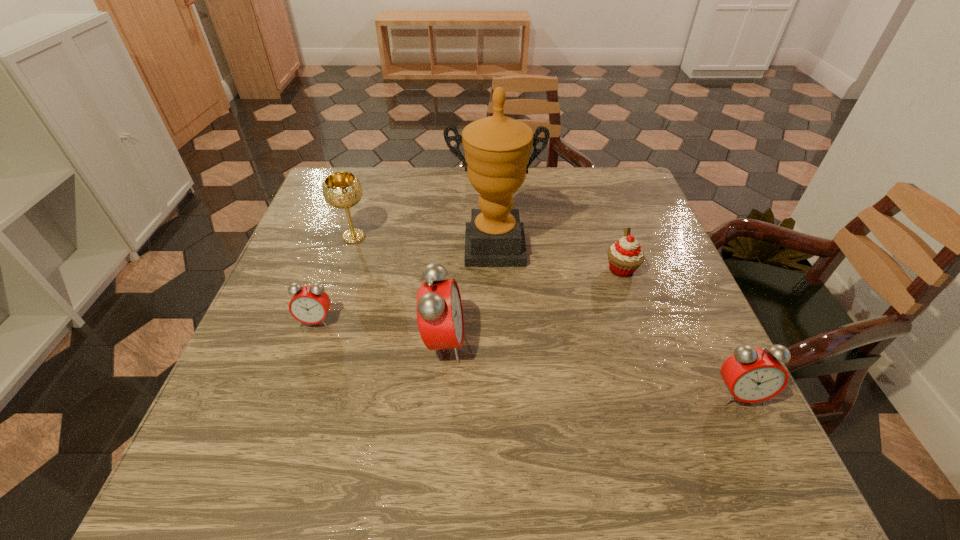
This screenshot has width=960, height=540. Identify the location of free space at the left edge. (332, 239).

The width and height of the screenshot is (960, 540). In the image, there is a desktop. Find the location of `blank space at the right edge`. blank space at the right edge is located at coordinates (682, 379).

The image size is (960, 540). I want to click on free spot at the far left corner of the desktop, so click(x=351, y=168).

Image resolution: width=960 pixels, height=540 pixels. What are the coordinates of `free spot at the far right corner of the desktop` in the screenshot? It's located at (603, 194).

The width and height of the screenshot is (960, 540). Find the location of `free space between the second alarm clock from right to left and the shortest alarm clock`. free space between the second alarm clock from right to left and the shortest alarm clock is located at coordinates (380, 332).

Find the location of a particular element. The image size is (960, 540). vacant area that lies between the second object from right to left and the second alarm clock from left to right is located at coordinates (533, 306).

Locate an element on the screen. This screenshot has width=960, height=540. vacant space that is in between the leftmost alarm clock and the award is located at coordinates (405, 284).

Identify the location of free space between the shortest alarm clock and the tallest object. The image size is (960, 540). (405, 284).

Locate an element on the screen. The image size is (960, 540). vacant point located between the rightmost alarm clock and the second alarm clock from right to left is located at coordinates (591, 368).

You are a GUI agent. You are given a task and a screenshot of the screen. Output one action in this format:
    pyautogui.click(x=<x>, y=<y>)
    Task: Click on the vacant area that lies between the chalice and the nearest alarm clock
    
    Given the screenshot: What is the action you would take?
    pyautogui.click(x=546, y=315)